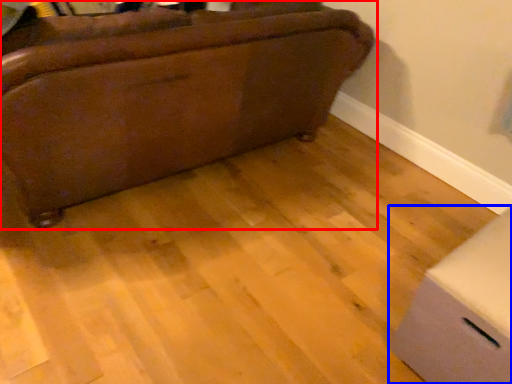
Question: Which point is closer to the camera, furniture (highlighted by a red box) or cardboard box (highlighted by a blue box)?

Choices:
 (A) furniture
 (B) cardboard box

Answer: (B)